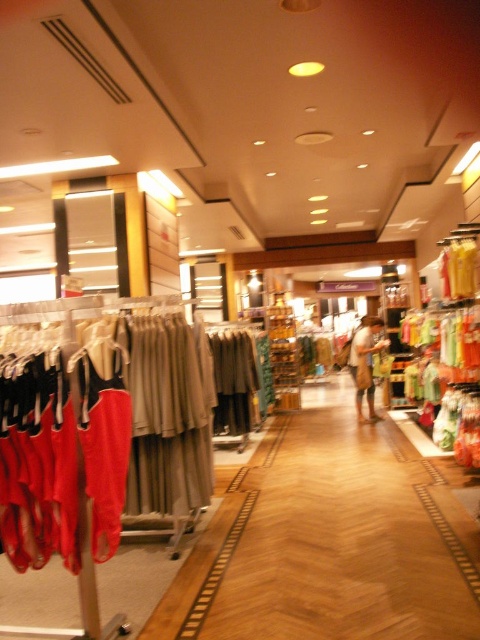
Between matte red dress at left and brown textured bag at center, which one is positioned higher?

matte red dress at left

Is point (37, 456) less distant than point (357, 406)?

Yes, it is in front of point (357, 406).

Between point (20, 476) and point (383, 342), which one is positioned behind?

The point (383, 342) is behind.

Locate an element on the screen. This screenshot has width=480, height=640. matte red dress at left is located at coordinates pyautogui.click(x=98, y=424).

Is matte red dress at left behind matte beige dress at center?

No, matte red dress at left is closer to the viewer.

Is matte red dress at left bigger than matte beige dress at center?

A: Indeed, matte red dress at left has a larger size compared to matte beige dress at center.

I want to click on matte red dress at left, so click(x=98, y=424).

Is brown textured bag at center wider than matte beige dress at center?

Yes.

Does brown textured bag at center have a greater height compared to matte beige dress at center?

Yes.

The width and height of the screenshot is (480, 640). What are the coordinates of `brown textured bag at center` in the screenshot? It's located at (364, 362).